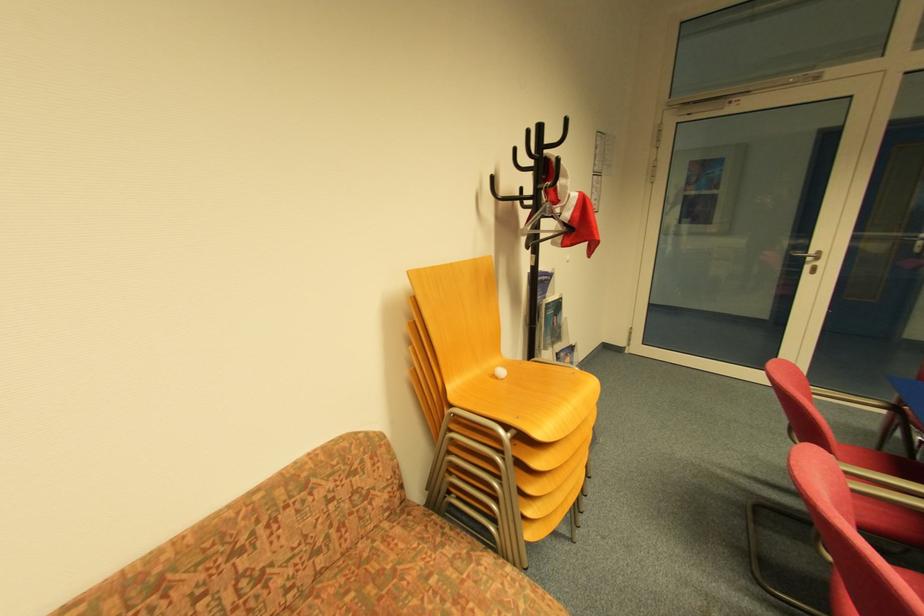
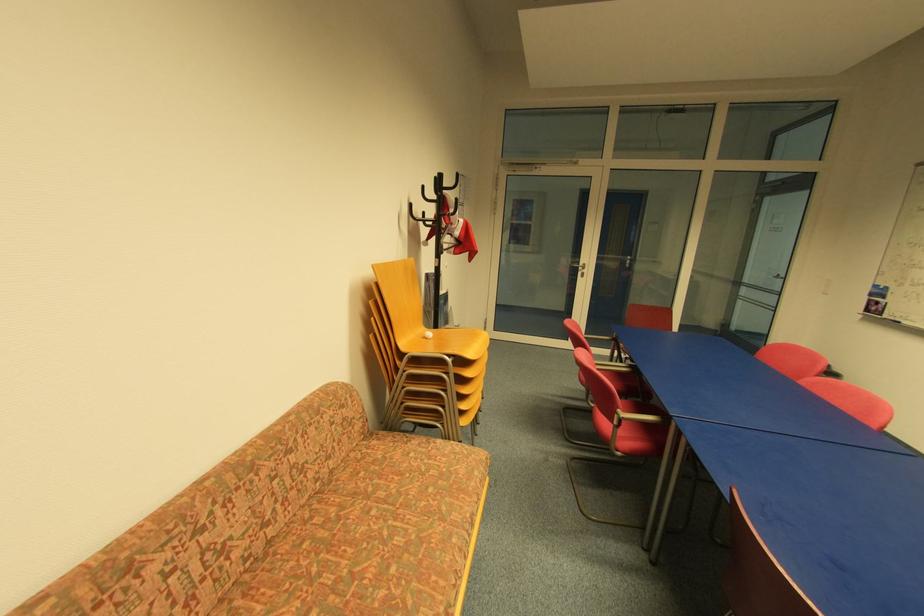
Locate, in the second image, the point that corresponds to (x=532, y=213) in the first image.

(434, 230)